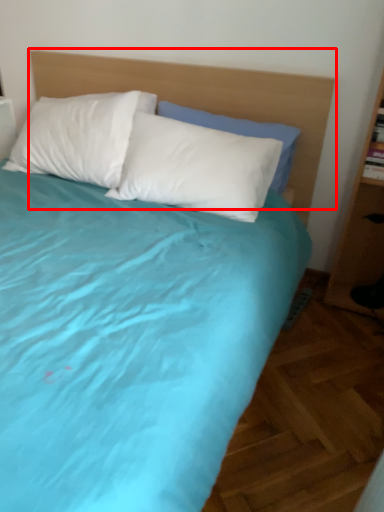
Question: From the image's perspective, where is headboard (annotated by the red box) located relative to pillow?

Choices:
 (A) below
 (B) above

Answer: (A)